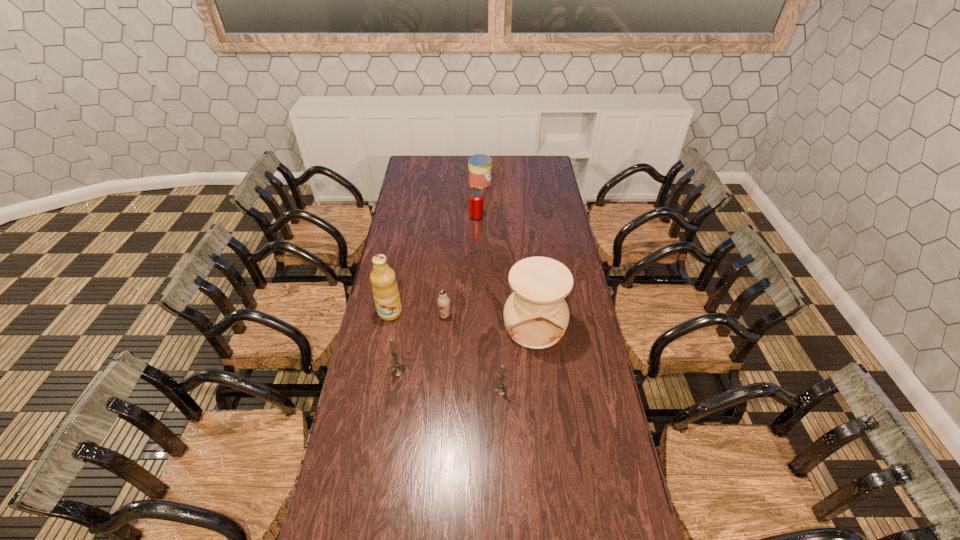
All candles are currently evenly spaced. To continue this pattern, where would you add another candle on the right? Please point out a vacant spot. Please provide its 2D coordinates. Your answer should be formatted as a tuple, i.e. [(x, y)], where the tuple contains the x and y coordinates of a point satisfying the conditions above.

[(612, 411)]